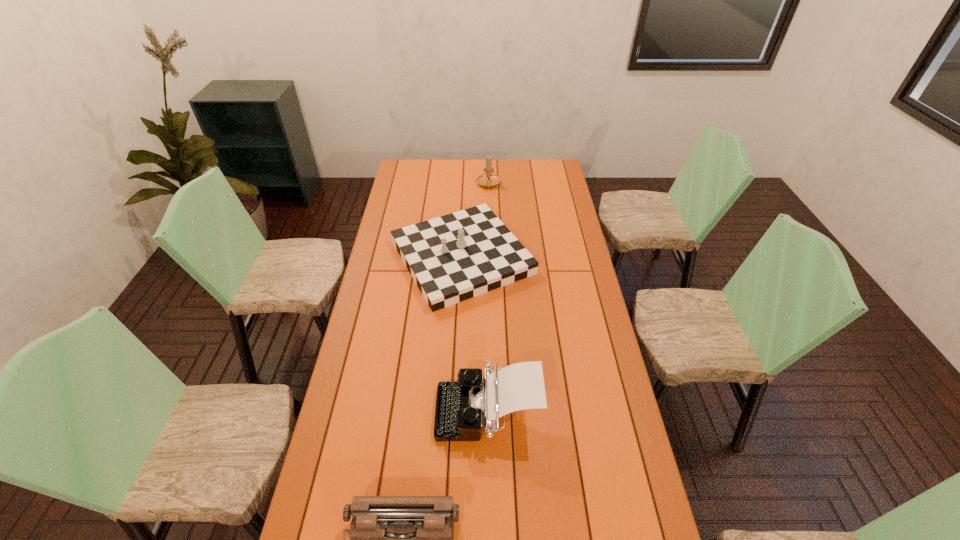
In the image, there is a desktop. Identify the location of vacant region at the far edge. (461, 165).

I want to click on vacant point at the left edge, so click(364, 440).

Where is `free region at the right edge of the desktop`? free region at the right edge of the desktop is located at coordinates point(564,287).

I want to click on vacant region between the farther typewriter and the checkerboard, so click(475, 334).

At what (x,y) coordinates should I click in order to perform the action: click on vacant area that lies between the second farthest object and the third farthest object. Please return your answer as a coordinate pair (x, y). Looking at the image, I should click on (475, 334).

This screenshot has height=540, width=960. Find the location of `free space that is in between the third farthest object and the candle`. free space that is in between the third farthest object and the candle is located at coordinates (488, 298).

Identify the location of the third closest object relative to the candle. The image size is (960, 540). (394, 539).

Locate an element on the screen. The image size is (960, 540). object that ranks as the closest to the candle is located at coordinates [x=452, y=258].